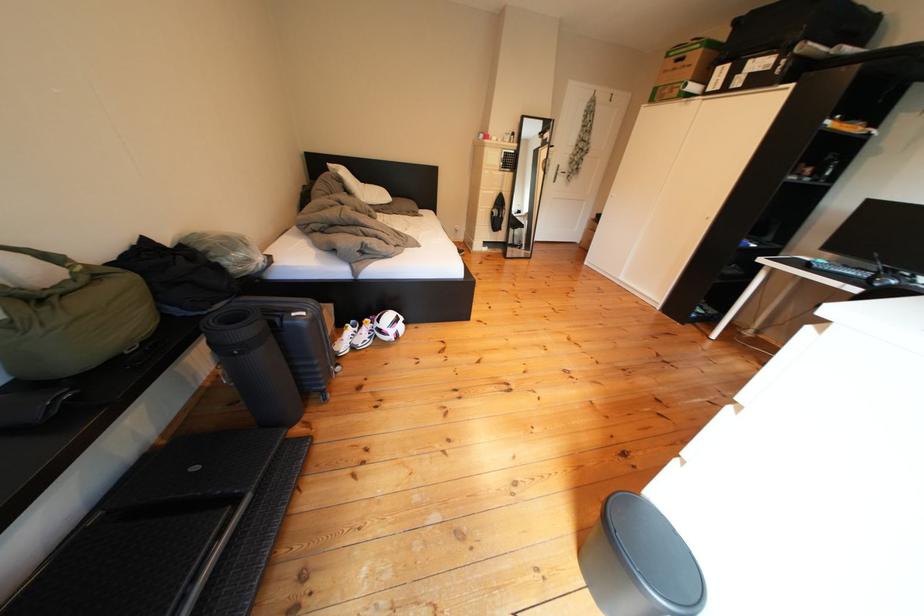
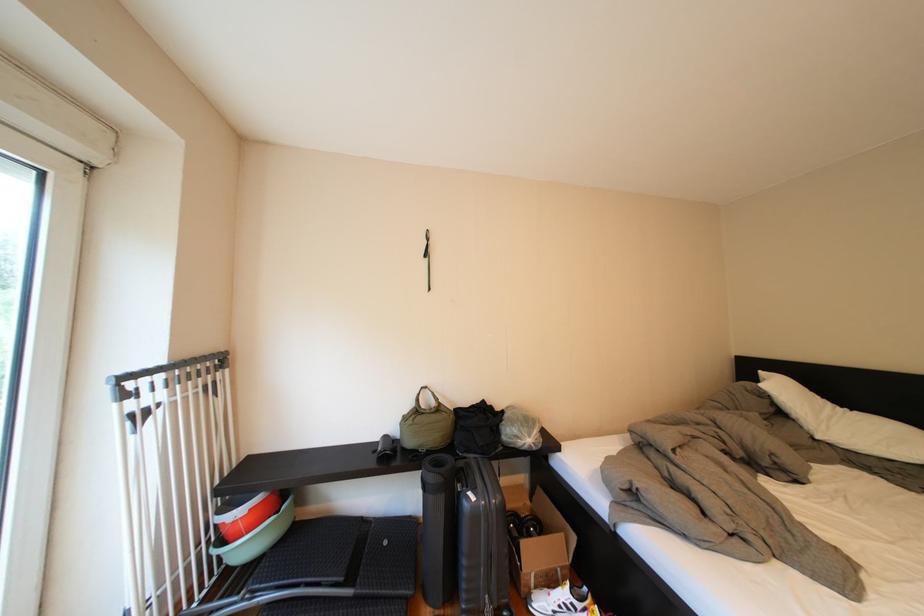
The point at (317, 318) is marked in the first image. Where is the corresponding point in the second image?

(487, 503)